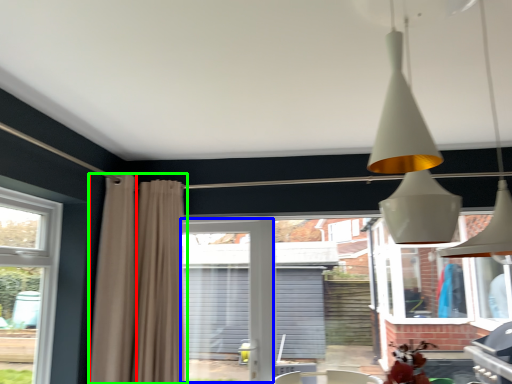
Question: Which is nearer to the curtain (highlighted by a red box)? screen door (highlighted by a blue box) or curtain (highlighted by a green box).

Choices:
 (A) screen door
 (B) curtain

Answer: (B)